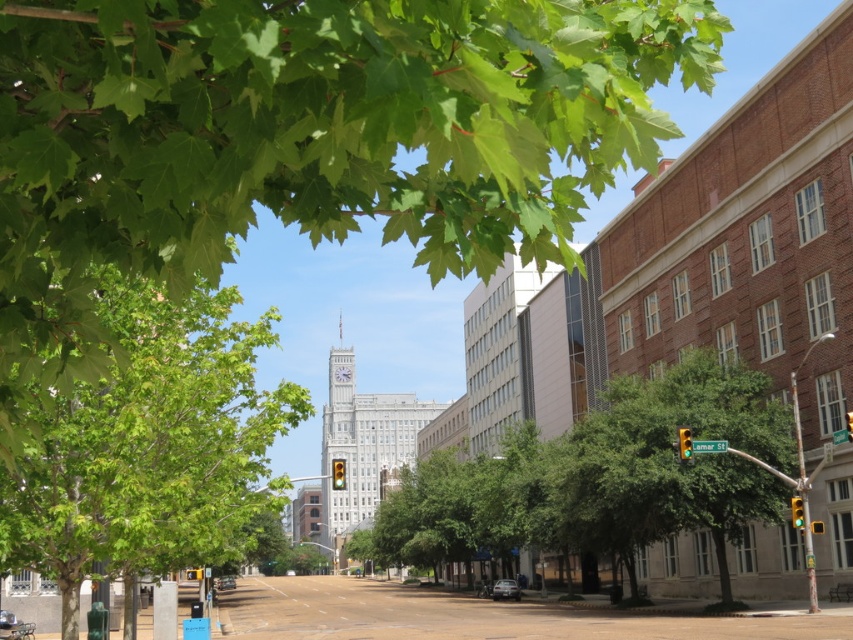
Between green leafy tree at upper left and green leafy tree at left, which one has less height?

With less height is green leafy tree at upper left.

What do you see at coordinates (305, 140) in the screenshot? I see `green leafy tree at upper left` at bounding box center [305, 140].

Describe the element at coordinates (305, 140) in the screenshot. I see `green leafy tree at upper left` at that location.

I want to click on green leafy tree at upper left, so click(305, 140).

Who is more distant from viewer, (263, 504) or (495, 492)?

The point (495, 492) is more distant.

Who is higher up, green leafy tree at left or green leafy tree at center?

Positioned higher is green leafy tree at left.

Who is more distant from viewer, (242,408) or (741,380)?

The point (741,380) is behind.

This screenshot has width=853, height=640. In order to click on green leafy tree at left in this screenshot , I will do point(149,445).

Which is more to the right, green leafy tree at upper left or green leafy tree at center?

Positioned to the right is green leafy tree at center.

Which is behind, point (282, 198) or point (422, 524)?

Positioned behind is point (422, 524).

I want to click on green leafy tree at upper left, so click(x=305, y=140).